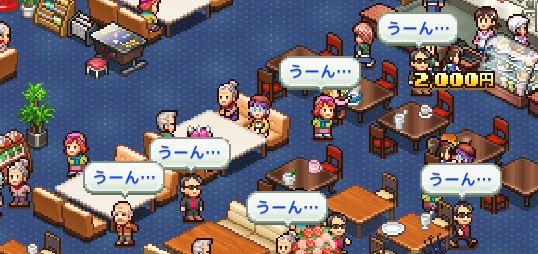
Locate an element on the screen. glass case is located at coordinates (502, 59).